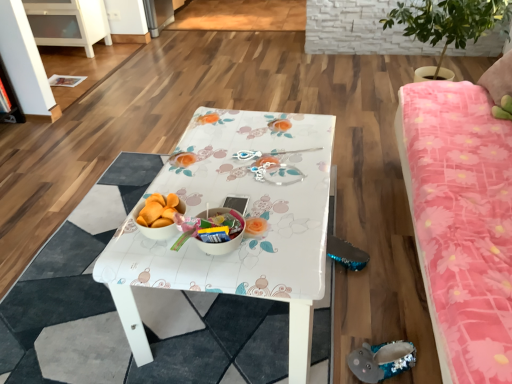
This screenshot has width=512, height=384. Identify the location of blank space to the left of pink floral fabric studio couch at right. (155, 293).